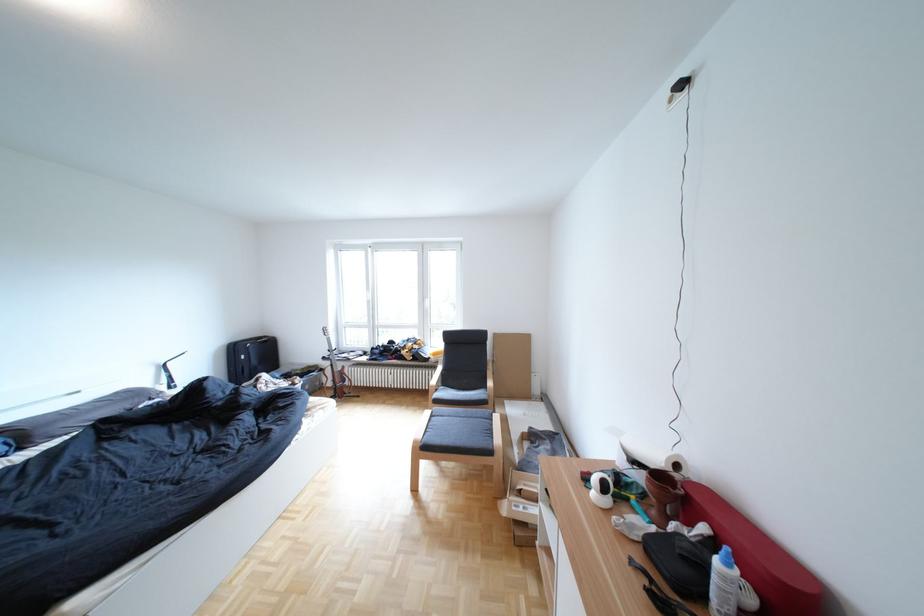
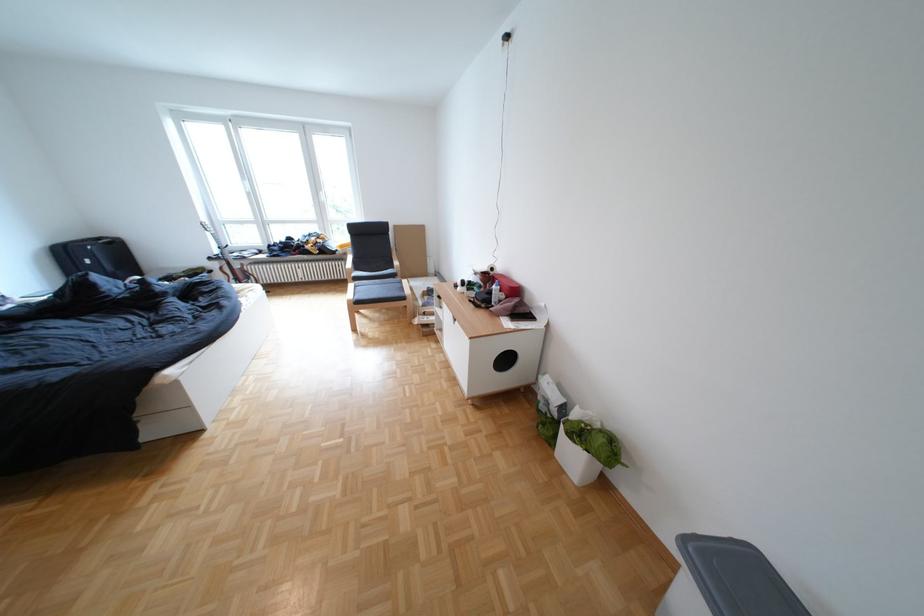
The first image is from the beginning of the video and the second image is from the end. How did the camera likely rotate when shooting the video?

The camera rotated toward right-down.